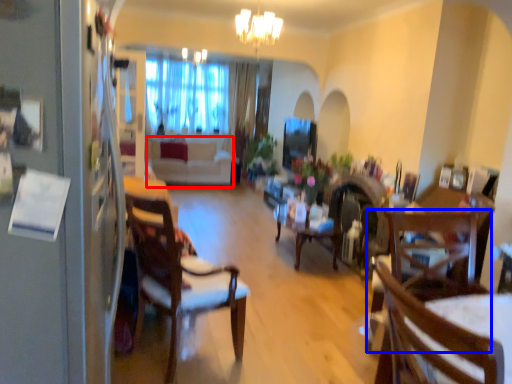
Question: Which object is further to the camera taking this photo, couch (highlighted by a red box) or chair (highlighted by a blue box)?

Choices:
 (A) couch
 (B) chair

Answer: (A)